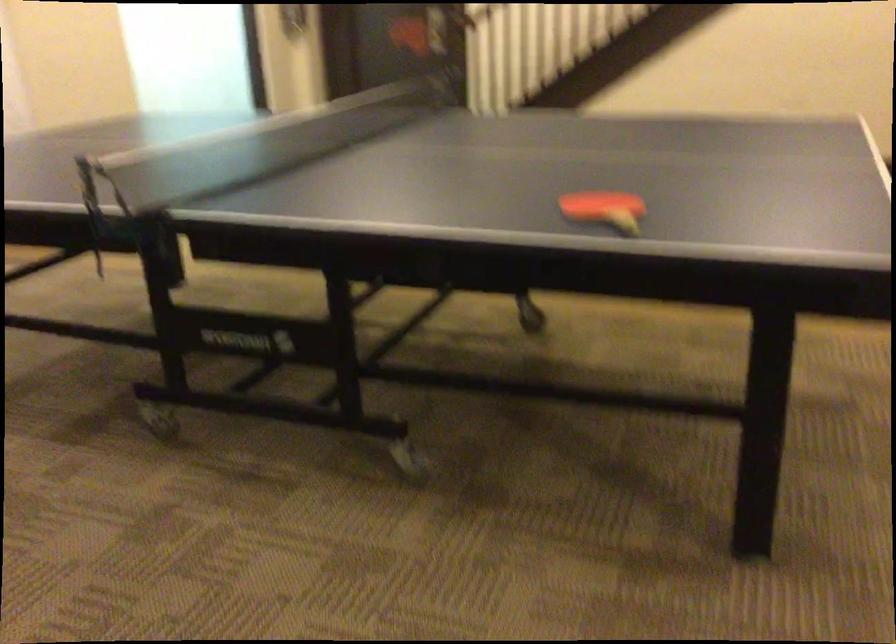
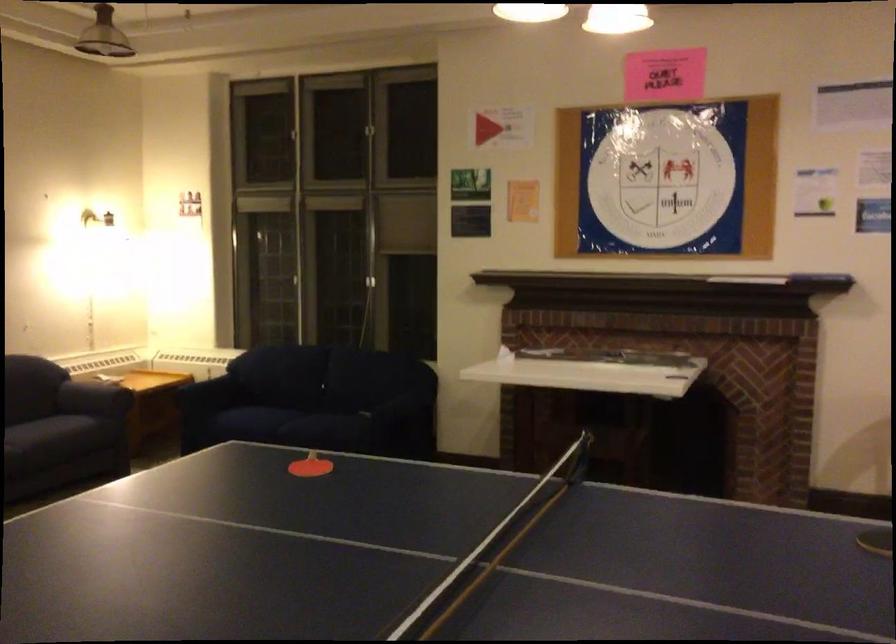
In the second image, find the point that corresponds to (639,232) in the first image.

(309, 466)